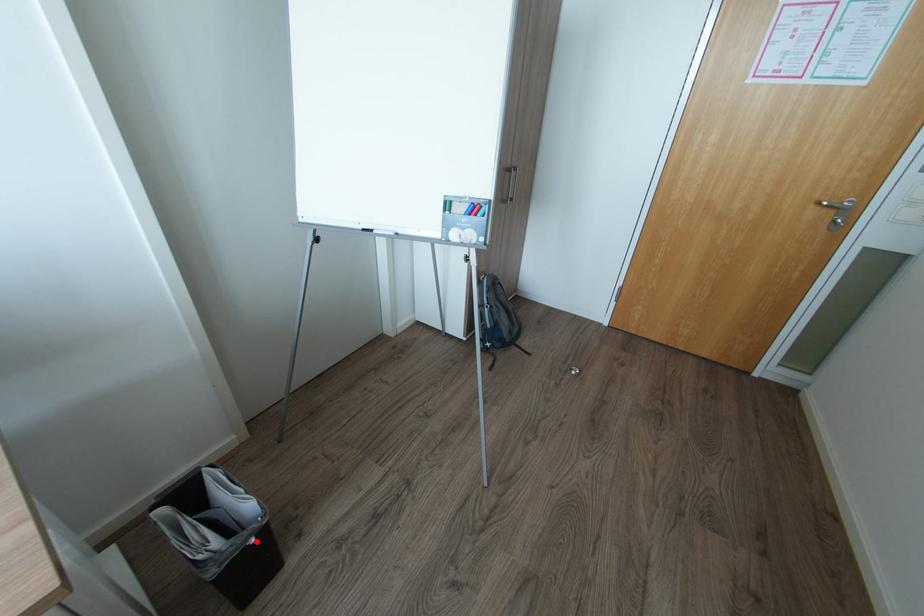
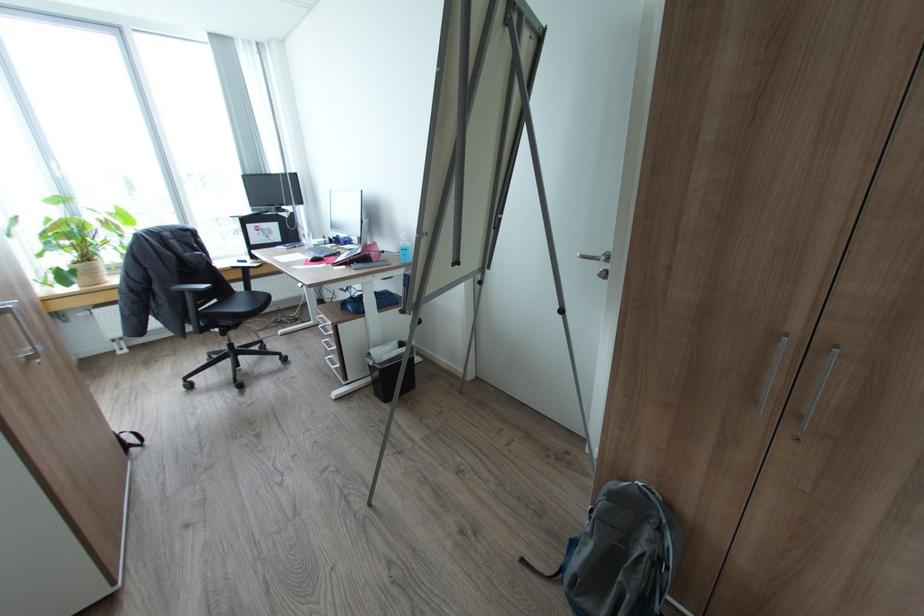
Locate, in the second image, the point that corresponds to the highlighted location in the first image.

(374, 363)